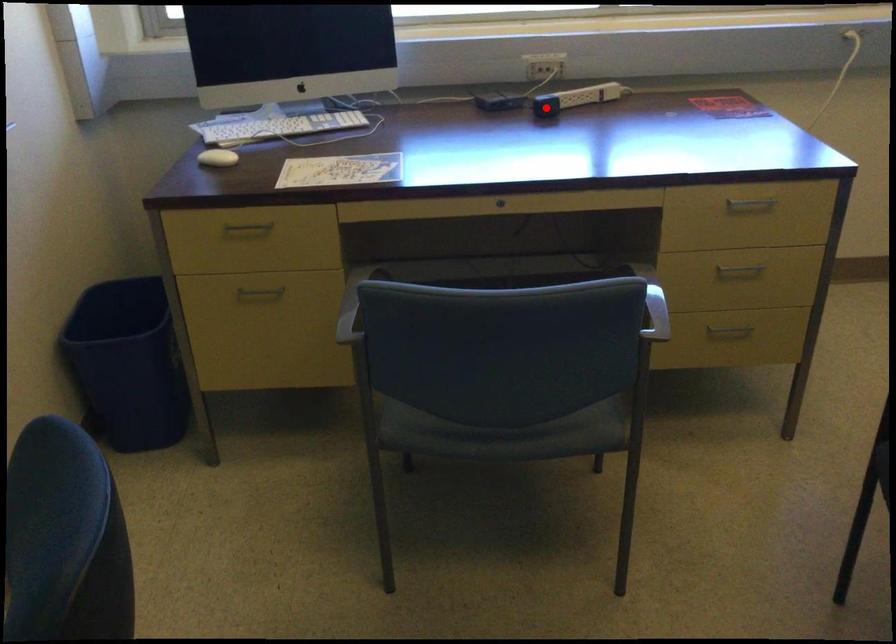
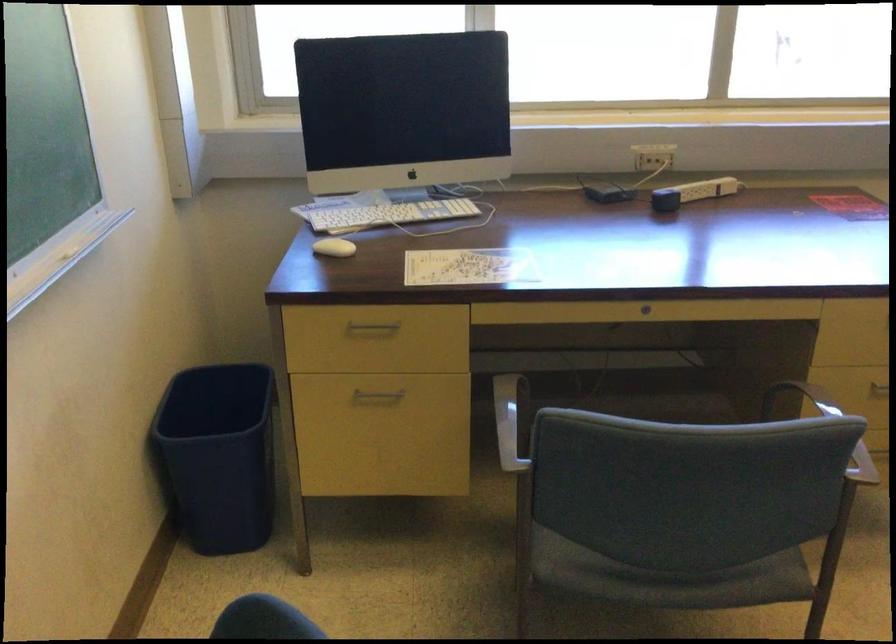
The point at the highlighted location is marked in the first image. Where is the corresponding point in the second image?

(665, 200)